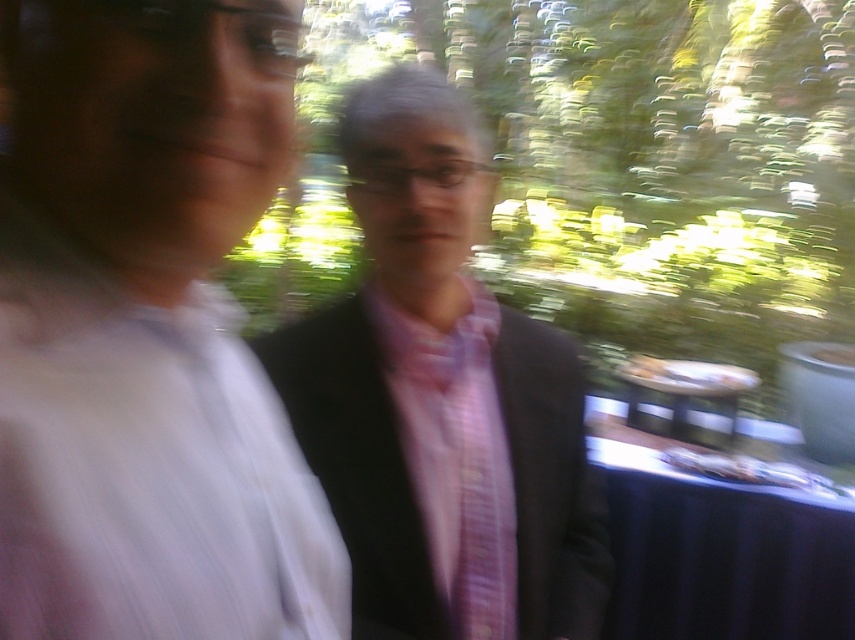
Question: Is matte black suit at center closer to camera compared to blue fabric table at lower right?

Choices:
 (A) yes
 (B) no

Answer: (A)

Question: Which object is the farthest from the pink striped tie at center?

Choices:
 (A) pink satin shirt at left
 (B) blue fabric table at lower right
 (C) matte black suit at center

Answer: (B)

Question: Does pink satin shirt at left have a smaller size compared to pink striped tie at center?

Choices:
 (A) no
 (B) yes

Answer: (A)

Question: Among these objects, which one is farthest from the camera?

Choices:
 (A) pink satin shirt at left
 (B) matte black suit at center

Answer: (B)

Question: Which point appears closest to the camera in this image?

Choices:
 (A) (668, 598)
 (B) (366, 614)
 (C) (10, 52)
 (D) (425, 412)

Answer: (C)

Question: Can you confirm if matte black suit at center is thinner than blue fabric table at lower right?

Choices:
 (A) no
 (B) yes

Answer: (B)